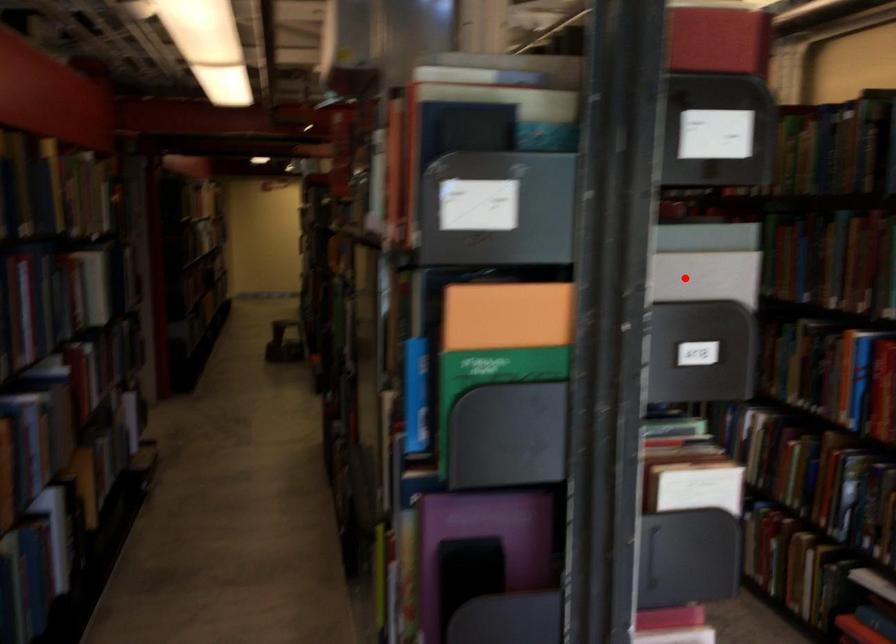
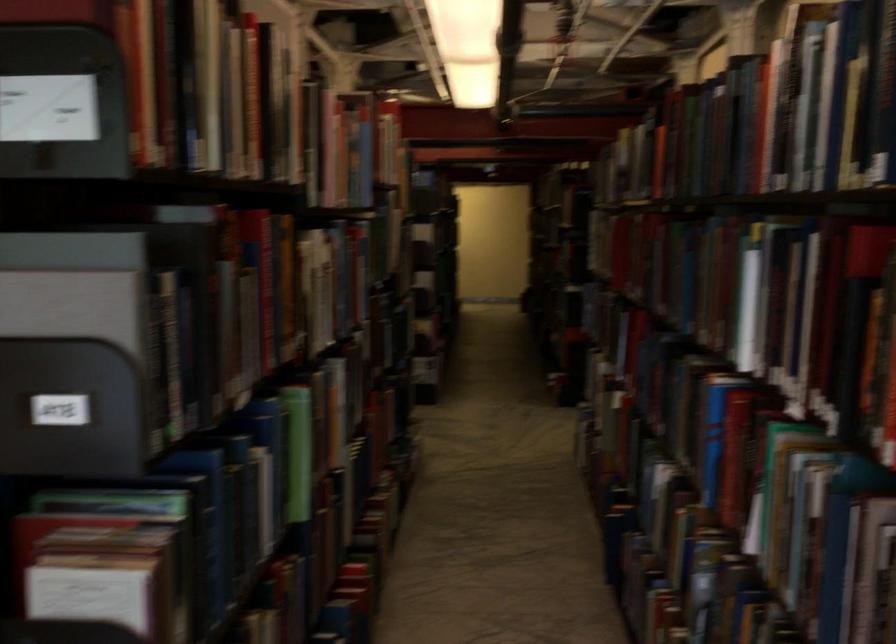
The point at the highlighted location is marked in the first image. Where is the corresponding point in the second image?

(67, 303)